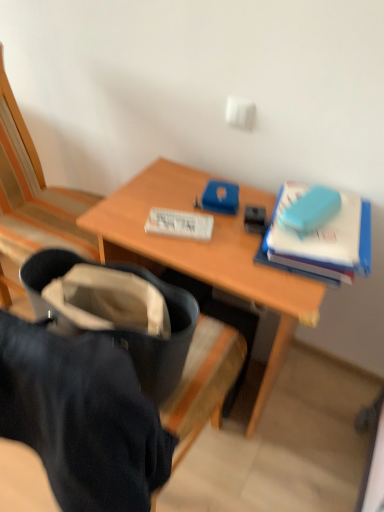
The width and height of the screenshot is (384, 512). In order to click on free point above blue matte book at upper right, arranged as the second paperback book when viewed from the left (from a real-world perspective) in this screenshot , I will do `click(333, 218)`.